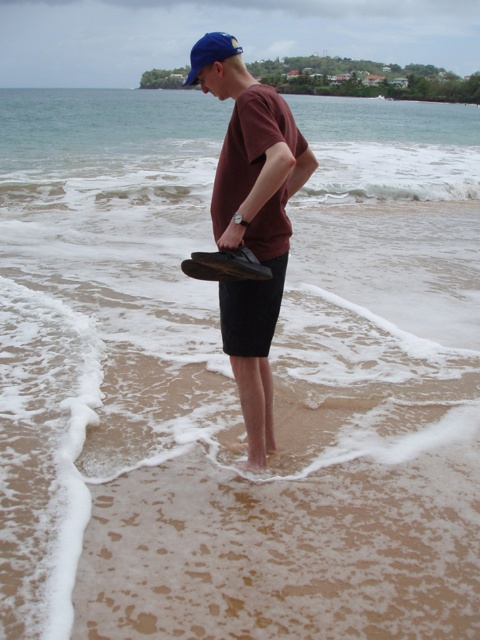
You are a photographer trying to capture the person in the scene. You need to ensure that both the matte black shoe at center and the blue fabric baseball cap at upper center are clearly visible in the frame. Given their sizes, which object might require you to adjust your camera angle to avoid being too small in the photo?

The matte black shoe at center is shorter than the blue fabric baseball cap at upper center, so the shoe might require adjusting the camera angle to ensure it is not too small in the photo.

You are a photographer trying to capture the exact location of the matte black shoe at center in the image. According to the coordinates provided, where would you focus your camera to ensure the shoe is centered in the frame?

The matte black shoe at center is located at coordinates point [252,220], so focusing the camera at that point would center the shoe in the frame.